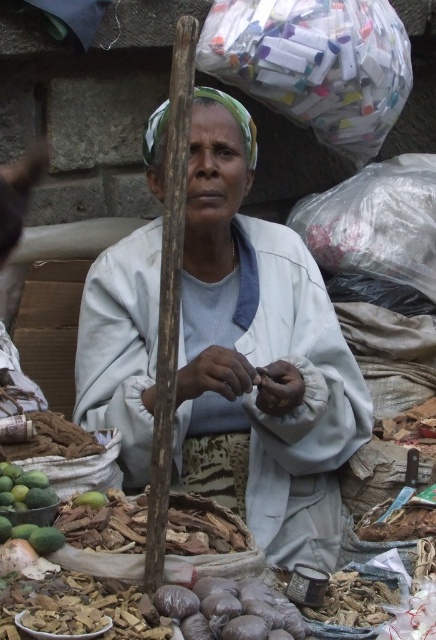
Who is shorter, white cloth at center or green matte mangoes at lower left?

green matte mangoes at lower left is shorter.

In the scene shown: Is white cloth at center wider than green matte mangoes at lower left?

Yes.

Is point (214, 96) positioned after point (46, 477)?

Yes, it is.

Image resolution: width=436 pixels, height=640 pixels. What are the coordinates of `white cloth at center` in the screenshot? It's located at (258, 356).